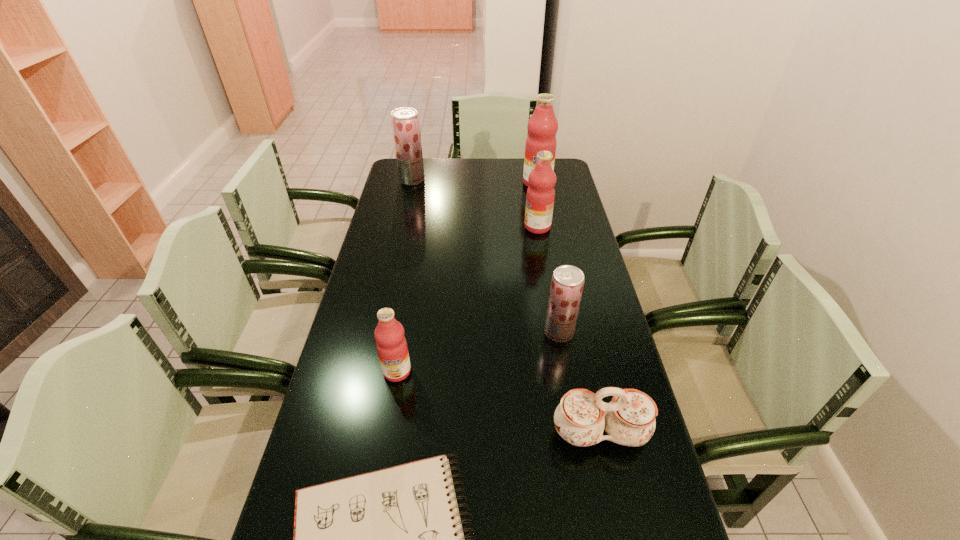
This screenshot has width=960, height=540. Find the location of `chinaware that is at the right edge`. chinaware that is at the right edge is located at coordinates (581, 417).

Where is `object that is at the far left corner`? object that is at the far left corner is located at coordinates (405, 123).

The height and width of the screenshot is (540, 960). Find the location of `object located in the far right corner section of the desktop`. object located in the far right corner section of the desktop is located at coordinates (542, 127).

Identify the location of vacant space at the far edge of the desktop. (481, 171).

Locate an element on the screen. The width and height of the screenshot is (960, 540). vacant area at the left edge of the desktop is located at coordinates (409, 192).

This screenshot has height=540, width=960. In the image, there is a desktop. Identify the location of vacant space at the right edge. (560, 224).

Locate an element on the screen. vacant space at the far right corner of the desktop is located at coordinates (567, 184).

Where is `free space between the bigger strawberry fruit juice and the tallest object`? The height and width of the screenshot is (540, 960). free space between the bigger strawberry fruit juice and the tallest object is located at coordinates (474, 181).

This screenshot has height=540, width=960. I want to click on free space between the tallest fruit juice and the bigger strawberry fruit juice, so click(474, 181).

Identify the location of empty space between the fifth farthest object and the smaller strawberry fruit juice. Image resolution: width=960 pixels, height=540 pixels. (478, 352).